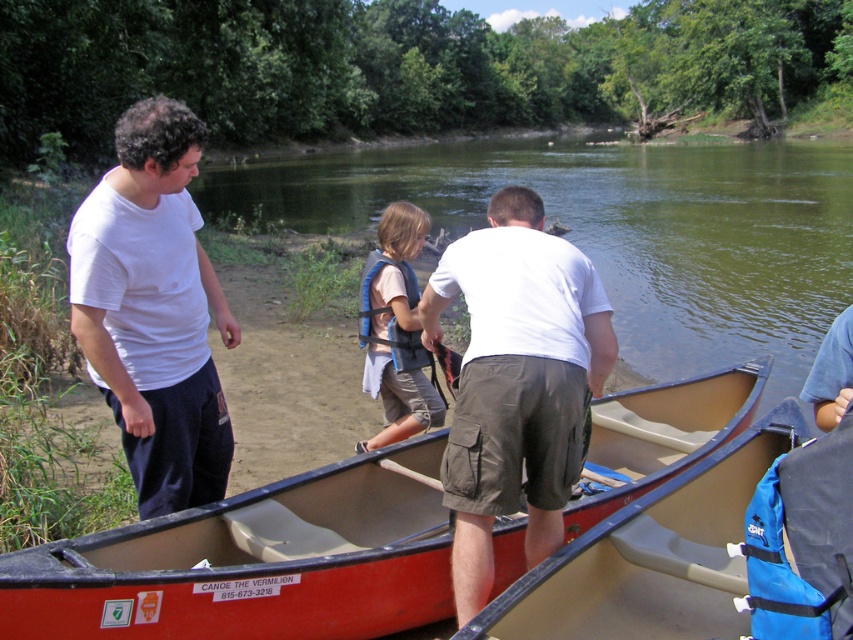
Is red plastic canoe at center thinner than white matte shirt at center?

No, red plastic canoe at center is not thinner than white matte shirt at center.

What do you see at coordinates (254, 561) in the screenshot?
I see `red plastic canoe at center` at bounding box center [254, 561].

Who is more distant from viewer, (x=96, y=634) or (x=506, y=401)?

Positioned behind is point (x=506, y=401).

Find the location of a particular element. red plastic canoe at center is located at coordinates (254, 561).

Does point (541, 253) come behind point (158, 312)?

That is False.

Is white matte shirt at center taller than white matte t-shirt at left?

Yes.

Describe the element at coordinates (515, 381) in the screenshot. I see `white matte shirt at center` at that location.

This screenshot has width=853, height=640. I want to click on white matte shirt at center, so click(515, 381).

Can you confirm if white matte t-shirt at left is positioned to the left of blue fabric life vest at center?

Indeed, white matte t-shirt at left is positioned on the left side of blue fabric life vest at center.

Is point (175, 353) positioned in front of point (431, 384)?

Yes, it is in front of point (431, 384).

Between point (219, 321) and point (424, 394), which one is positioned behind?

The point (424, 394) is more distant.

Where is `white matte t-shirt at left`? white matte t-shirt at left is located at coordinates (154, 308).